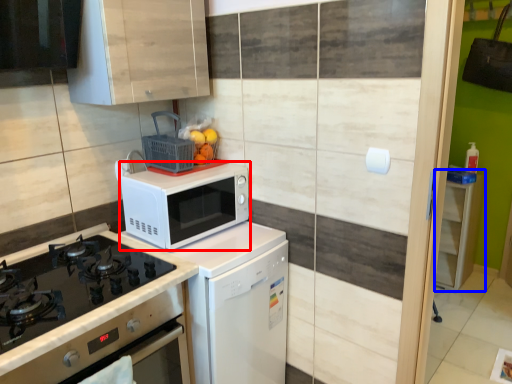
Question: Which object appears farthest to the camera in this image, microwave oven (highlighted by a red box) or cabinetry (highlighted by a blue box)?

Choices:
 (A) microwave oven
 (B) cabinetry

Answer: (B)